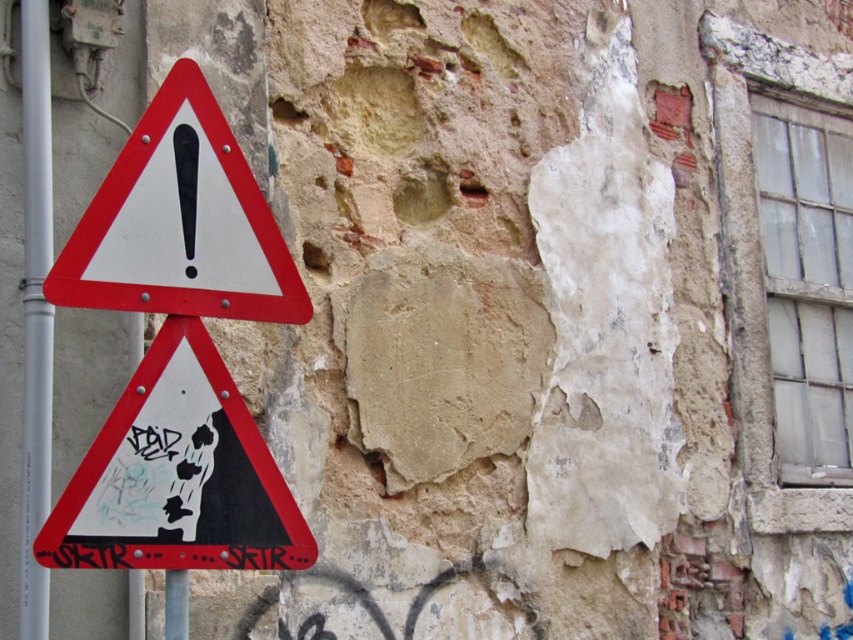
Which is more to the right, matte red triangle at left or red plastic triangle at left?

Positioned to the right is matte red triangle at left.

Is point (154, 394) positioned after point (126, 260)?

Yes, point (154, 394) is behind point (126, 260).

In order to click on matte red triangle at left in this screenshot , I will do `click(177, 476)`.

Is matte red triangle at left bigger than metallic pole at left?

Actually, matte red triangle at left might be smaller than metallic pole at left.

Locate an element on the screen. This screenshot has height=640, width=853. matte red triangle at left is located at coordinates (177, 476).

Which is in front, point (259, 525) or point (45, 97)?

Positioned in front is point (259, 525).

Image resolution: width=853 pixels, height=640 pixels. Identify the location of matte red triangle at left. (177, 476).

Which is more to the left, red plastic triangle at left or metallic pole at left?

From the viewer's perspective, metallic pole at left appears more on the left side.

Can you confirm if red plastic triangle at left is shorter than metallic pole at left?

Yes, red plastic triangle at left is shorter than metallic pole at left.

I want to click on red plastic triangle at left, so click(180, 221).

Identify the location of red plastic triangle at left. (180, 221).